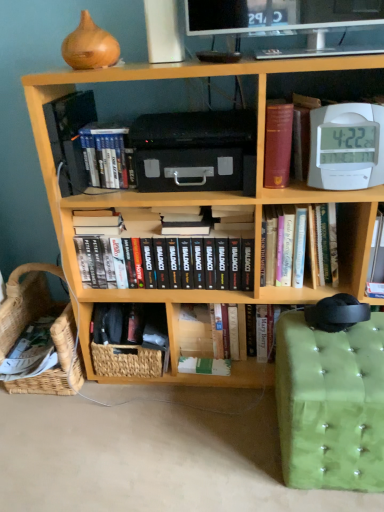
Where is `free space in front of white paper at center, marked as the first paperback book in a bottom-to-top arrangement`? This screenshot has width=384, height=512. free space in front of white paper at center, marked as the first paperback book in a bottom-to-top arrangement is located at coordinates coord(216,409).